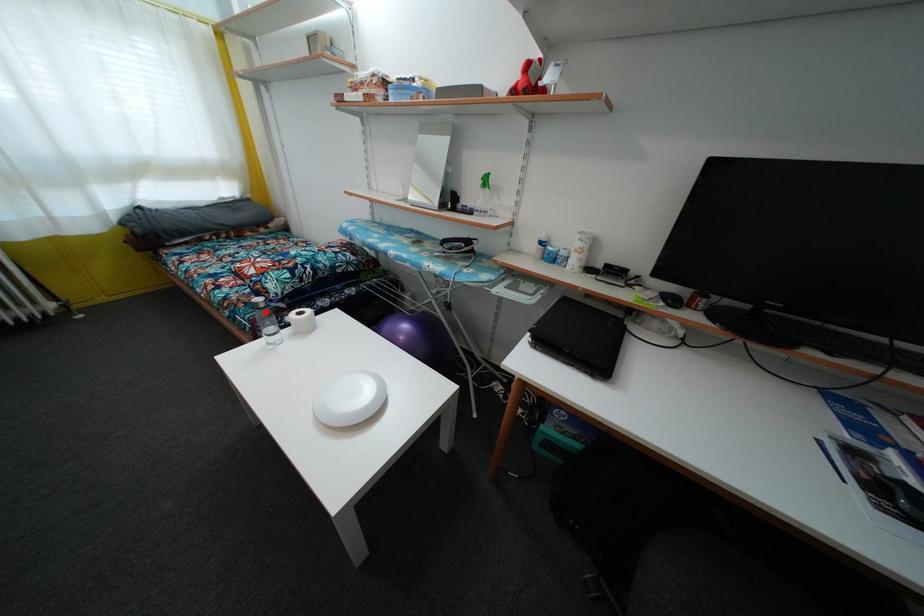
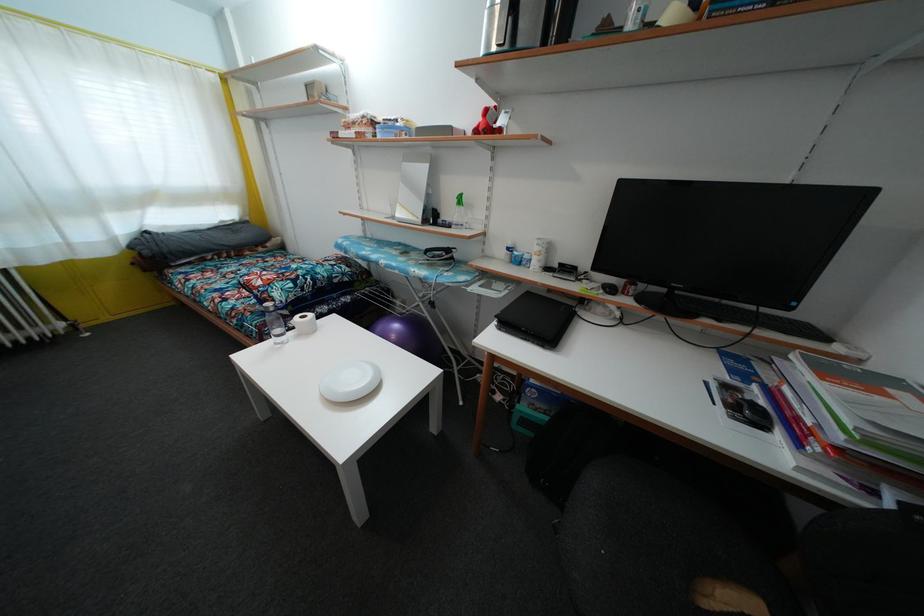
In the second image, find the point that corresponds to the highlighted location in the first image.

(275, 315)